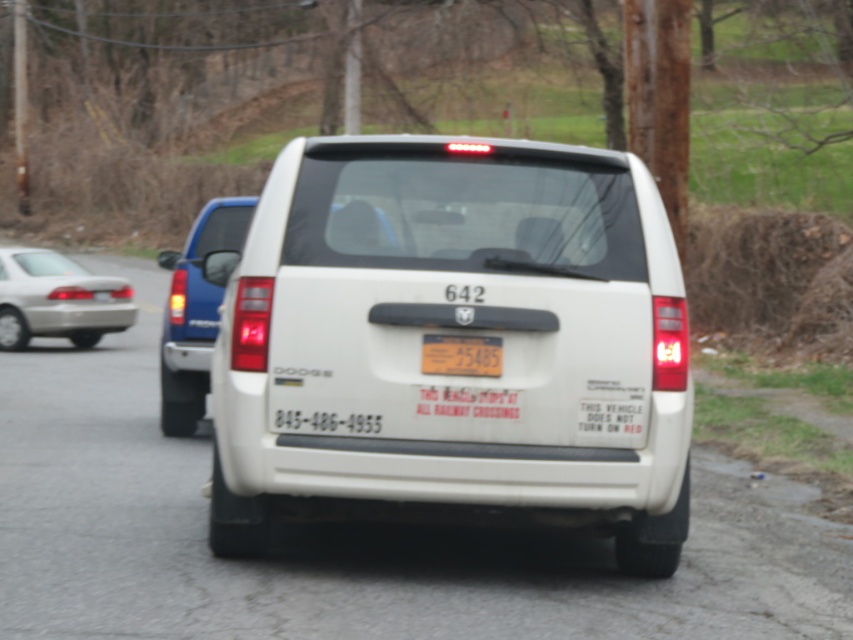
Which is behind, point (204, 241) or point (219, 236)?

The point (204, 241) is more distant.

The height and width of the screenshot is (640, 853). What are the coordinates of `white matte minivan at center` in the screenshot? It's located at (195, 310).

Who is higher up, white matte pickup truck at center or white matte minivan at center?

white matte minivan at center is higher up.

Which of these two, white matte pickup truck at center or white matte minivan at center, stands taller?

With more height is white matte minivan at center.

Who is more forward, (x=447, y=292) or (x=196, y=275)?

Positioned in front is point (x=447, y=292).

Locate an element on the screen. Image resolution: width=853 pixels, height=640 pixels. white matte pickup truck at center is located at coordinates (453, 333).

Can you confirm if white matte minivan at center is positioned to the right of metallic reflective license plate at center?

In fact, white matte minivan at center is to the left of metallic reflective license plate at center.

Is white matte minivan at center wider than metallic reflective license plate at center?

Correct, the width of white matte minivan at center exceeds that of metallic reflective license plate at center.

Identify the location of white matte minivan at center. The image size is (853, 640). (195, 310).